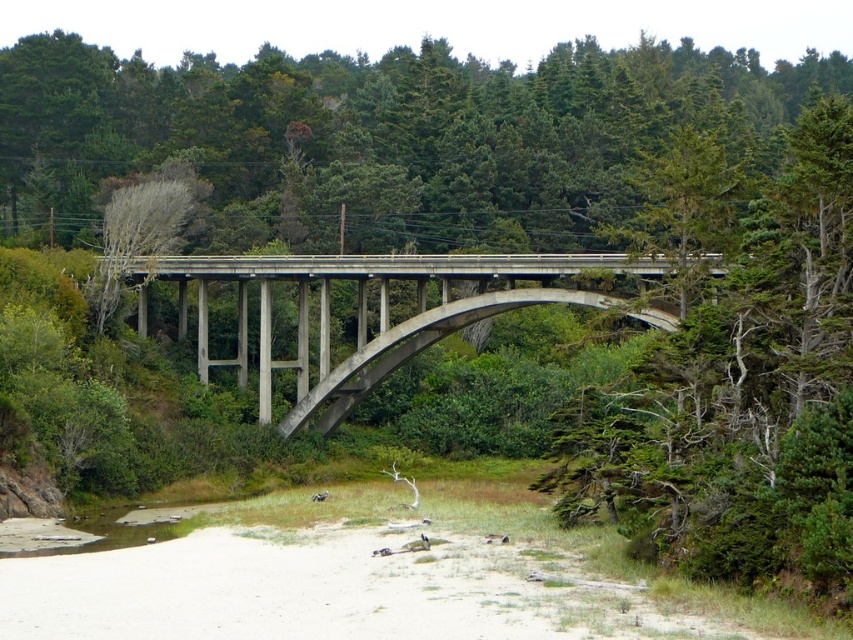
Is point (720, 269) positioned after point (80, 515)?

No, it is not.

What do you see at coordinates (383, 308) in the screenshot?
I see `concrete bridge at center` at bounding box center [383, 308].

What are the coordinates of `concrete bridge at center` in the screenshot? It's located at (383, 308).

The height and width of the screenshot is (640, 853). I want to click on concrete bridge at center, so click(x=383, y=308).